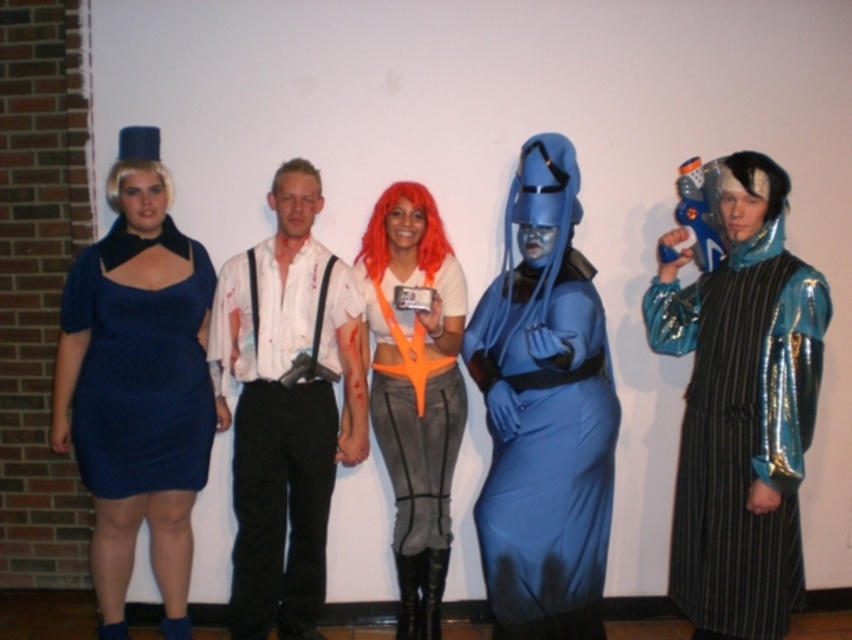
In the scene shown: You are organizing a costume party and need to arrange the metallic blue robe at center and the navy blue fabric dress at left on a rack. Which costume requires a larger hanger?

The metallic blue robe at center requires a larger hanger because it is bigger than the navy blue fabric dress at left.

You are standing in front of the group of five individuals dressed in costumes. You need to locate the matte blue costume at center. Based on the coordinates provided, can you determine its exact position relative to the other costumes?

The matte blue costume at center is positioned at coordinates point 0.645 on the x axis and 0.640 on the y axis.

You are organizing a group photo and need to arrange the matte blue costume at center and the white matte shirt at center in a specific order. According to the image, which one should be placed to the right of the other?

The matte blue costume at center should be placed to the right of the white matte shirt at center because the matte blue costume at center is positioned on the right side of the white matte shirt at center in the image.